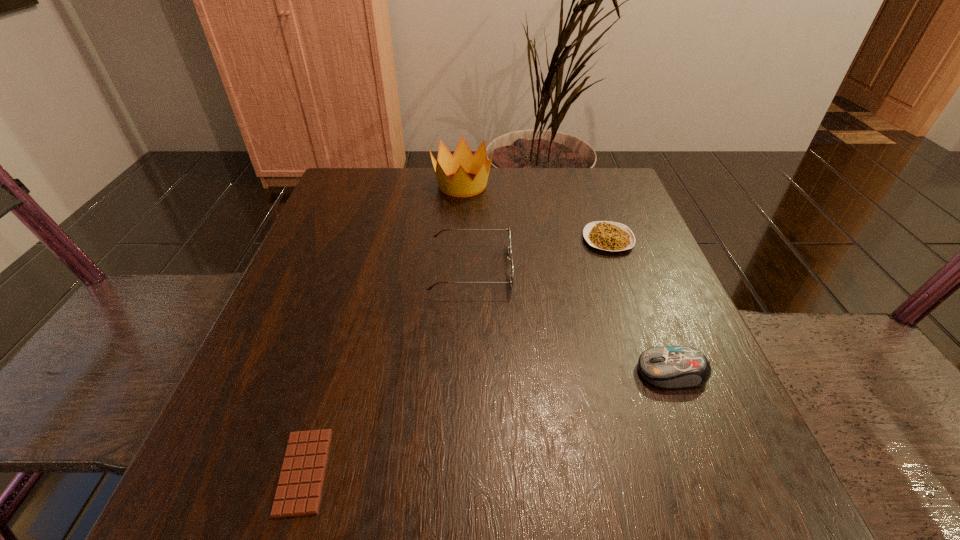
I want to click on crown, so click(462, 162).

You are a GUI agent. You are given a task and a screenshot of the screen. Output one action in this format:
    pyautogui.click(x=<x>, y=<y>)
    Task: Click on the farthest object
    Image resolution: width=960 pixels, height=540 pixels.
    Given the screenshot: What is the action you would take?
    pyautogui.click(x=462, y=162)

The image size is (960, 540). Find the location of `sunglasses`. sunglasses is located at coordinates (509, 253).

What are the coordinates of `the fourth farthest object` in the screenshot? It's located at (670, 367).

Where is `the third tallest object`? This screenshot has width=960, height=540. the third tallest object is located at coordinates (670, 367).

At what (x,y) coordinates should I click in order to perform the action: click on legume. Please return your answer as a coordinate pair (x, y). Image resolution: width=960 pixels, height=540 pixels. Looking at the image, I should click on (610, 236).

You are a GUI agent. You are given a task and a screenshot of the screen. Output one action in this format:
    pyautogui.click(x=<x>, y=<y>)
    Task: Click on the candy bar
    The image size is (960, 540).
    Given the screenshot: What is the action you would take?
    pyautogui.click(x=298, y=493)

This screenshot has width=960, height=540. Find the location of `the leftmost object`. the leftmost object is located at coordinates (298, 493).

The image size is (960, 540). Identify the location of vacant area located 0.360m on the front of the farthest object. (456, 310).

Where is `free space located 0.140m on the front-facing side of the sunglasses`? This screenshot has height=540, width=960. free space located 0.140m on the front-facing side of the sunglasses is located at coordinates (581, 268).